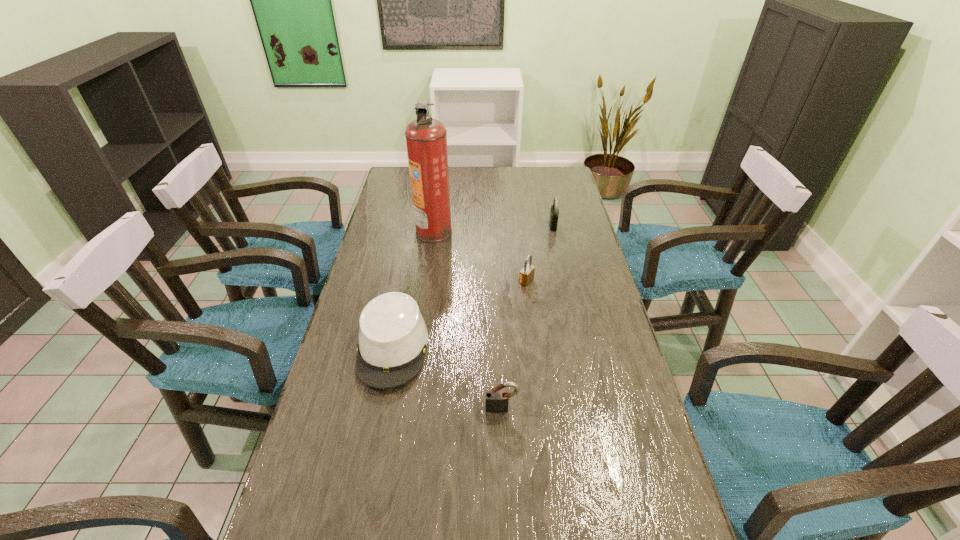
You are a GUI agent. You are given a task and a screenshot of the screen. Output one action in this format:
    pyautogui.click(x=<x>, y=<y>)
    Task: Click on the free space located on the left of the second padlock from right to left
    
    Given the screenshot: What is the action you would take?
    pyautogui.click(x=435, y=281)

In order to click on free region located with the keyhole on the front of the third object from left to right in this screenshot , I will do `click(503, 436)`.

The height and width of the screenshot is (540, 960). In order to click on vacant region located 0.160m on the front-facing side of the hat in this screenshot , I will do `click(372, 455)`.

Image resolution: width=960 pixels, height=540 pixels. What are the coordinates of `fire extinguisher located in the left edge section of the desktop` in the screenshot? It's located at (426, 138).

This screenshot has height=540, width=960. Find the location of `hat that is at the left edge`. hat that is at the left edge is located at coordinates (393, 337).

Identify the location of object that is positioned at the right edge. (554, 212).

Find the location of a particular element. Image resolution: width=960 pixels, height=540 pixels. vacant region at the far edge of the desktop is located at coordinates (489, 184).

This screenshot has width=960, height=540. In order to click on vacant space at the left edge of the desktop in this screenshot , I will do `click(334, 383)`.

Image resolution: width=960 pixels, height=540 pixels. What are the coordinates of `vacant space at the right edge of the desktop` in the screenshot? It's located at (653, 463).

Identify the location of vacant space at the far left corner. (410, 190).